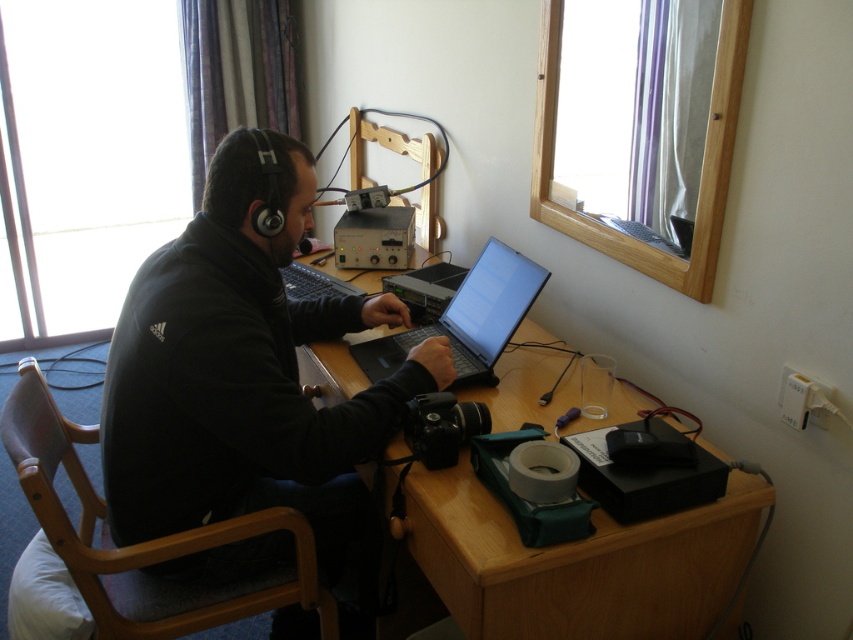
Question: Which of the following is the farthest from the observer?

Choices:
 (A) black matte jacket at center
 (B) black plastic laptop at center
 (C) black fabric chair at left
 (D) wooden at center

Answer: (B)

Question: Is black matte jacket at center smaller than black fabric chair at left?

Choices:
 (A) no
 (B) yes

Answer: (A)

Question: Is black matte jacket at center thinner than wooden at center?

Choices:
 (A) no
 (B) yes

Answer: (B)

Question: Does black fabric chair at left appear over black plastic laptop at center?

Choices:
 (A) no
 (B) yes

Answer: (A)

Question: Which object is positioned farthest from the wooden at center?

Choices:
 (A) black fabric chair at left
 (B) black plastic laptop at center
 (C) black matte jacket at center

Answer: (A)

Question: Which point is farther from the camera taking this photo?

Choices:
 (A) (492, 385)
 (B) (151, 604)
 (C) (483, 589)
 (D) (229, 404)

Answer: (A)